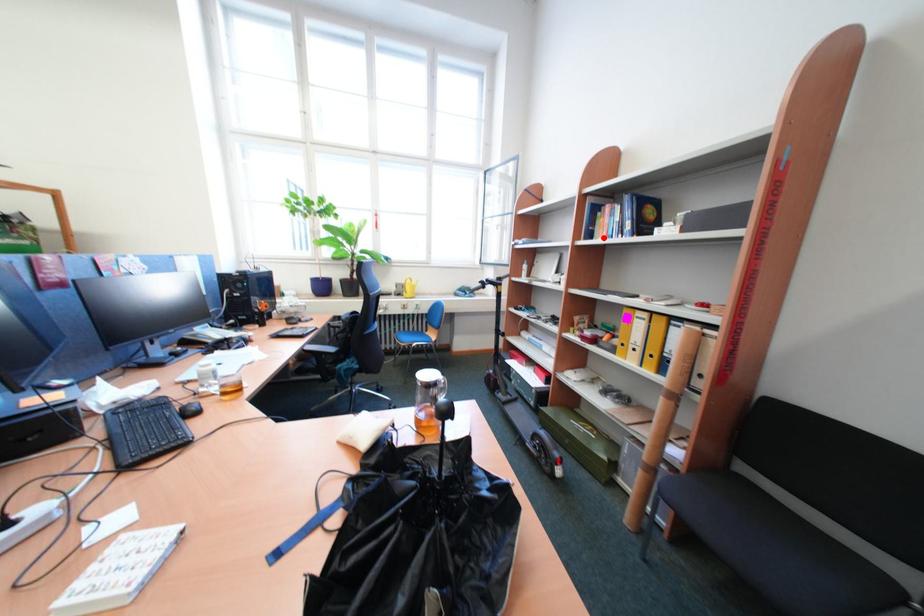
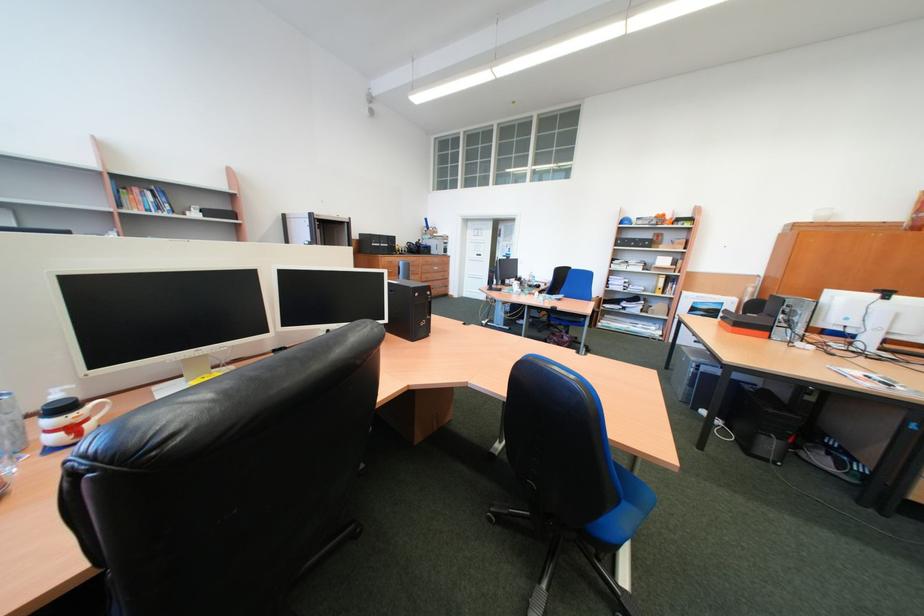
Where in the second image is the point corresponding to the highlighted location from the first image?

(134, 207)